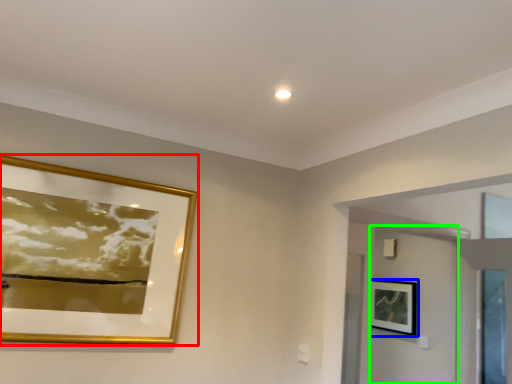
Question: Which object is positioned closest to picture frame (highlighted by a red box)? Select from picture frame (highlighted by a blue box) and door (highlighted by a green box).

Choices:
 (A) picture frame
 (B) door

Answer: (B)